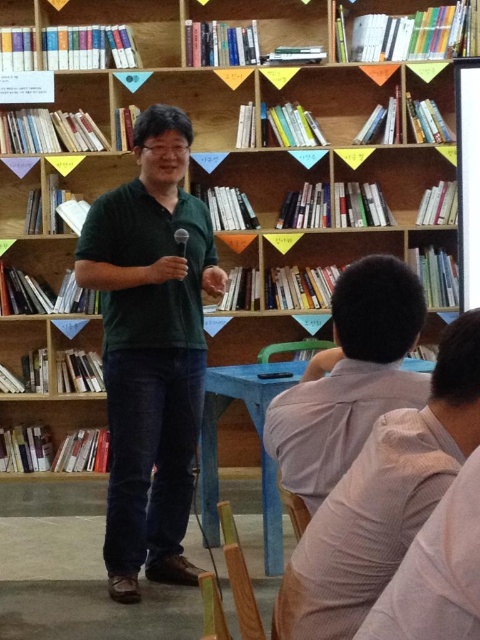
Between point (158, 394) and point (325, 456), which one is positioned in front?

Point (325, 456) is in front.

I want to click on green matte shirt at center, so click(x=151, y=349).

Consider the image. Does green matte shirt at center lie in front of gray cotton shirt at lower right?

No.

Is green matte shirt at center thinner than gray cotton shirt at lower right?

No, green matte shirt at center is not thinner than gray cotton shirt at lower right.

Is point (165, 186) closer to camera compared to point (319, 541)?

No, it is behind (319, 541).

This screenshot has width=480, height=640. Find the location of `green matte shirt at center`. green matte shirt at center is located at coordinates tap(151, 349).

Between gray cotton shirt at lower right and light gray shirt at center, which one appears on the right side from the viewer's perspective?

Positioned to the right is light gray shirt at center.

Does gray cotton shirt at lower right appear on the right side of light gray shirt at center?

No, gray cotton shirt at lower right is not to the right of light gray shirt at center.

This screenshot has width=480, height=640. I want to click on gray cotton shirt at lower right, so click(x=383, y=499).